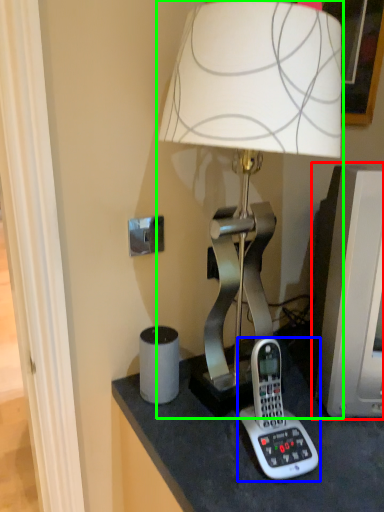
Question: Which object is positioned farthest from computer monitor (highlighted by a red box)? Select from corded phone (highlighted by a blue box) and lamp (highlighted by a green box).

Choices:
 (A) corded phone
 (B) lamp

Answer: (B)